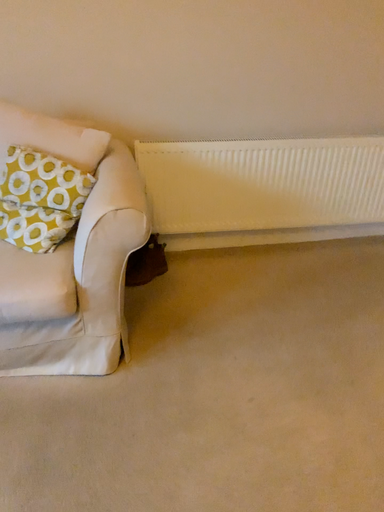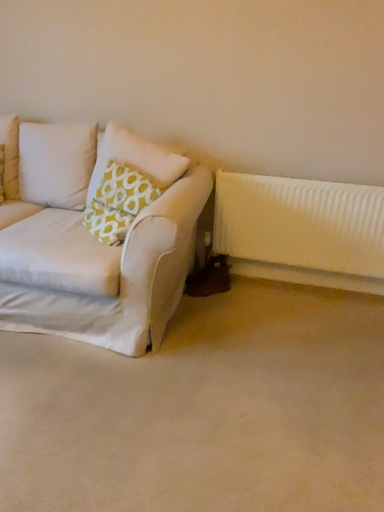
Question: Which way did the camera rotate in the video?

Choices:
 (A) rotated downward
 (B) rotated upward

Answer: (B)